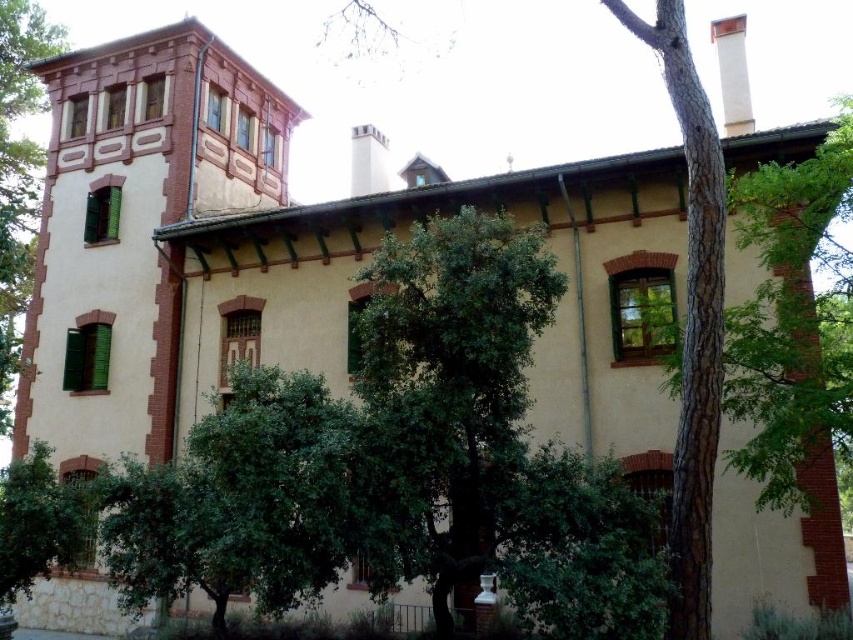
You are a gardener standing in front of the two story building. You see the green leafy tree at center and the green textured bark at center. Which one is higher up in the scene?

The green leafy tree at center is above the green textured bark at center, so the green leafy tree at center is higher up in the scene.

In the scene shown: You are standing in front of the two story building and notice two points marked on the image. The first point is at coordinate point [689,330] and the second is at point [51,22]. Which point is closer to you as you face the building?

Point [689,330] is in front of point [51,22], so it is closer to you as you face the building.